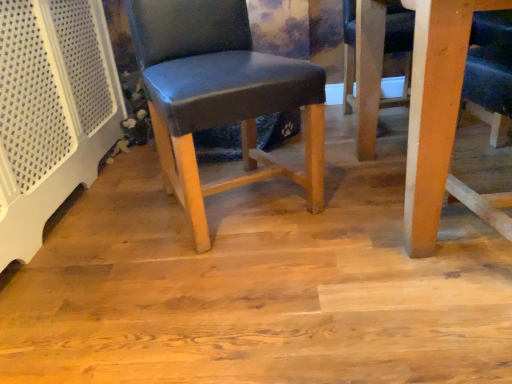
I want to click on vacant area that is in front of matte blue leather chair at center, so click(x=229, y=288).